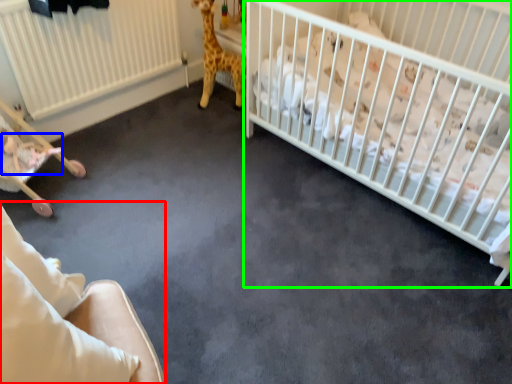
Question: Which is nearer to the rocking chair (highlighted by a red box)? newborn (highlighted by a blue box) or infant bed (highlighted by a green box).

Choices:
 (A) newborn
 (B) infant bed

Answer: (A)